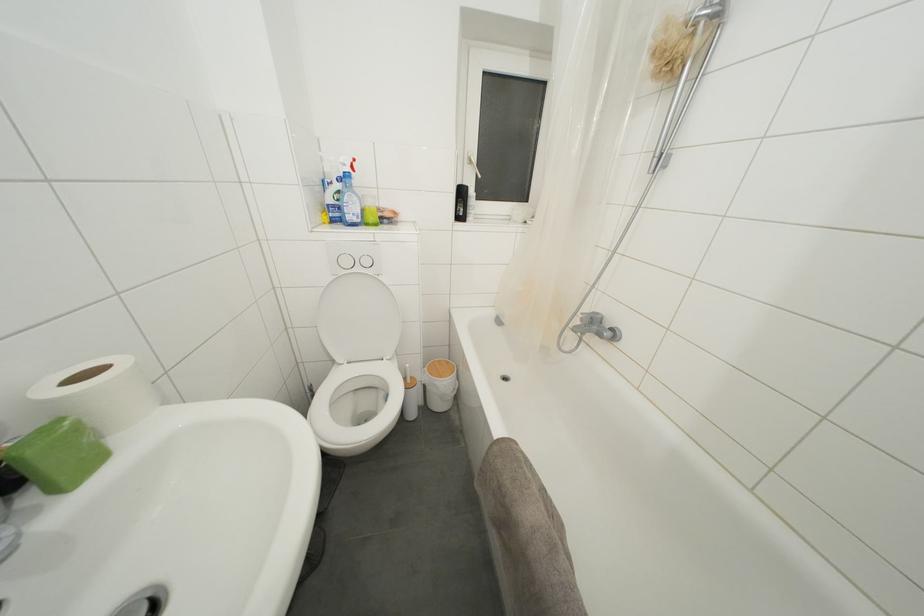
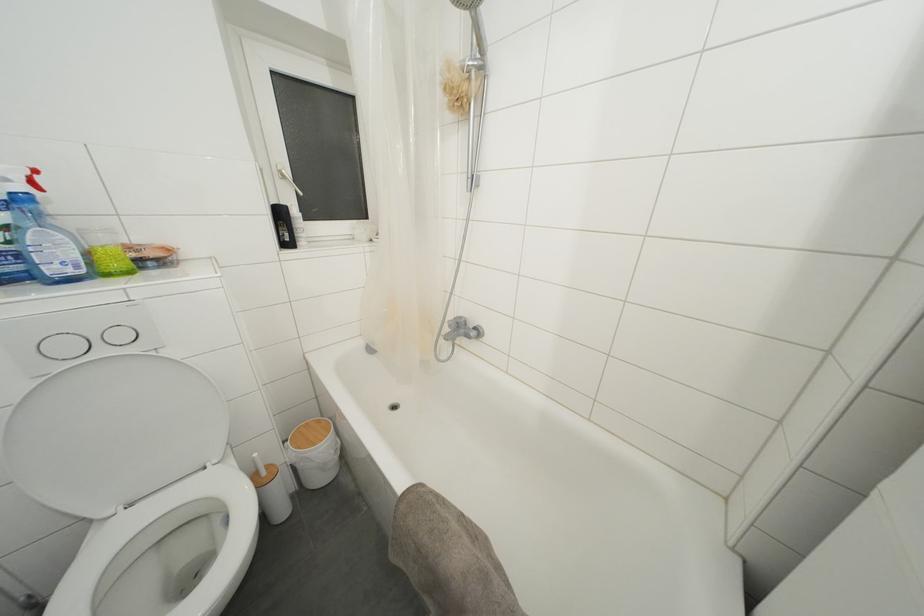
Where in the second image is the point corresponding to (590,314) from the first image?

(455, 321)